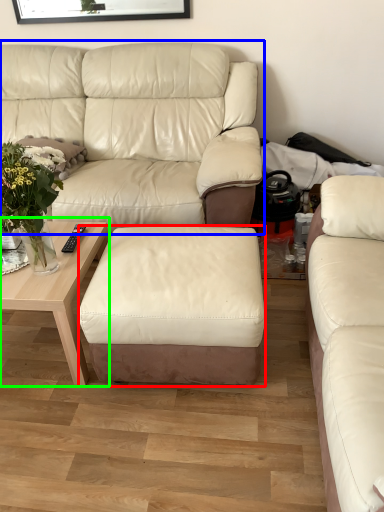
Question: Considering the real-world distances, which object is closest to stool (highlighted by a red box)? studio couch (highlighted by a blue box) or coffee table (highlighted by a green box).

Choices:
 (A) studio couch
 (B) coffee table

Answer: (B)